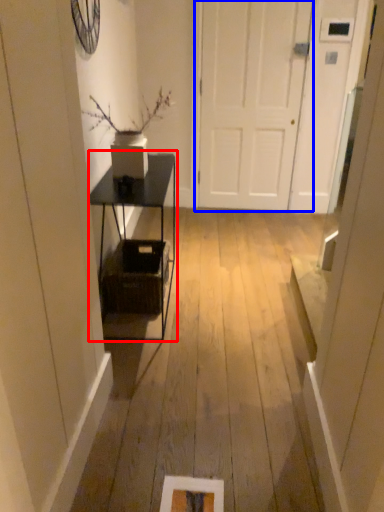
Question: Which object is closer to the camera taking this photo, table (highlighted by a red box) or door (highlighted by a blue box)?

Choices:
 (A) table
 (B) door

Answer: (A)